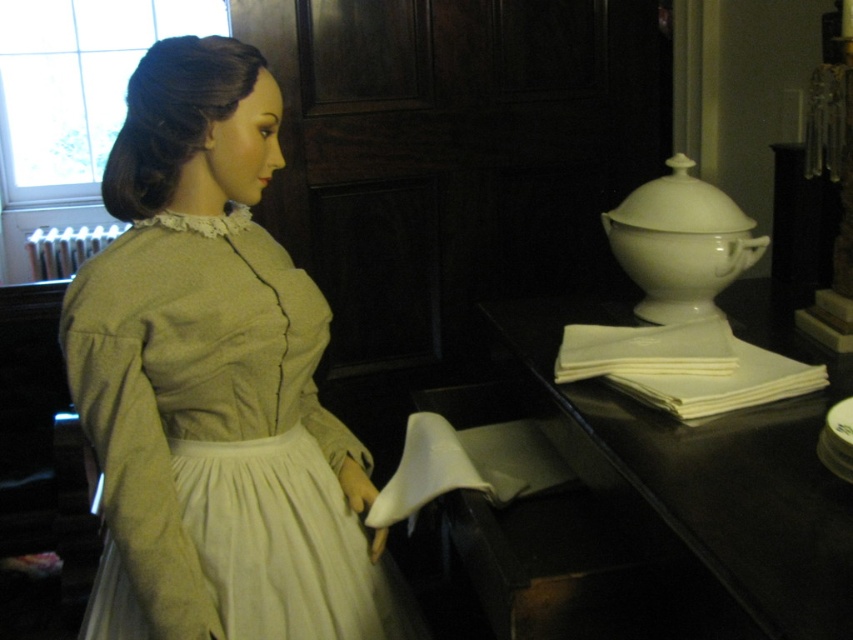
Question: Can you confirm if matte green dress at center is positioned below white matte napkins at right?

Choices:
 (A) no
 (B) yes

Answer: (A)

Question: Observing the image, what is the correct spatial positioning of matte green dress at center in reference to white matte napkins at right?

Choices:
 (A) left
 (B) right

Answer: (A)

Question: From the image, what is the correct spatial relationship of matte green dress at center in relation to white matte napkins at right?

Choices:
 (A) above
 (B) below

Answer: (A)

Question: Which of the following is the closest to the observer?

Choices:
 (A) white matte napkins at right
 (B) matte green dress at center

Answer: (A)